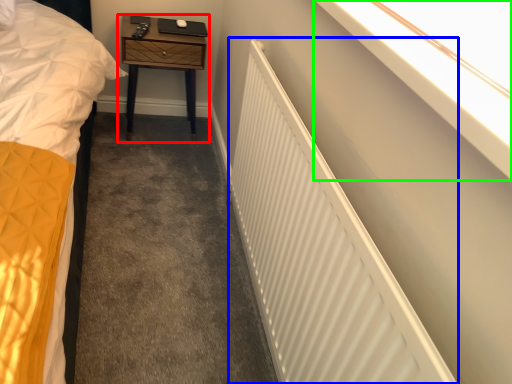
Question: Based on their relative distances, which object is nearer to nightstand (highlighted by a red box)? Choose from radiator (highlighted by a blue box) and window sill (highlighted by a green box).

Choices:
 (A) radiator
 (B) window sill

Answer: (A)